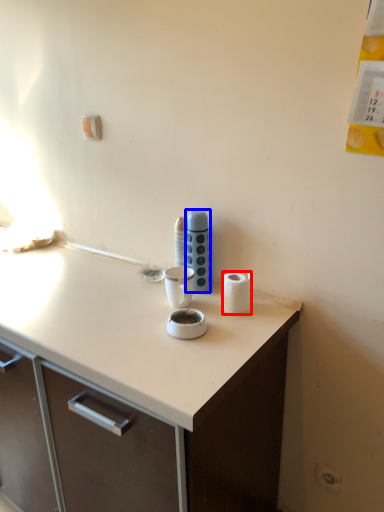
Question: Which of the following is the farthest to the observer, paper towel (highlighted by a red box) or appliance (highlighted by a blue box)?

Choices:
 (A) paper towel
 (B) appliance

Answer: (B)